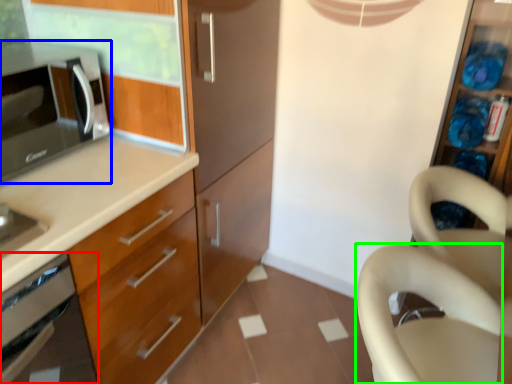
Question: Based on their relative distances, which object is nearer to oven (highlighted by a red box)? Choose from microwave oven (highlighted by a blue box) and swivel chair (highlighted by a green box).

Choices:
 (A) microwave oven
 (B) swivel chair

Answer: (A)